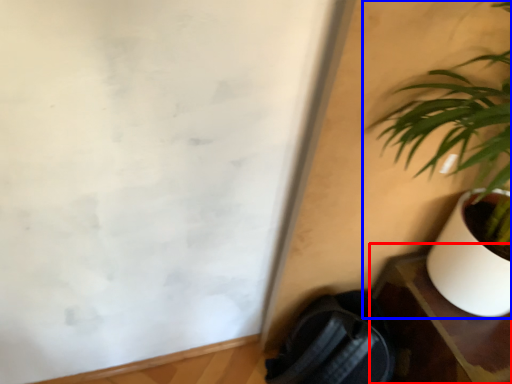
Question: Which object appears farthest to the camera in this image, table (highlighted by a red box) or houseplant (highlighted by a blue box)?

Choices:
 (A) table
 (B) houseplant

Answer: (A)